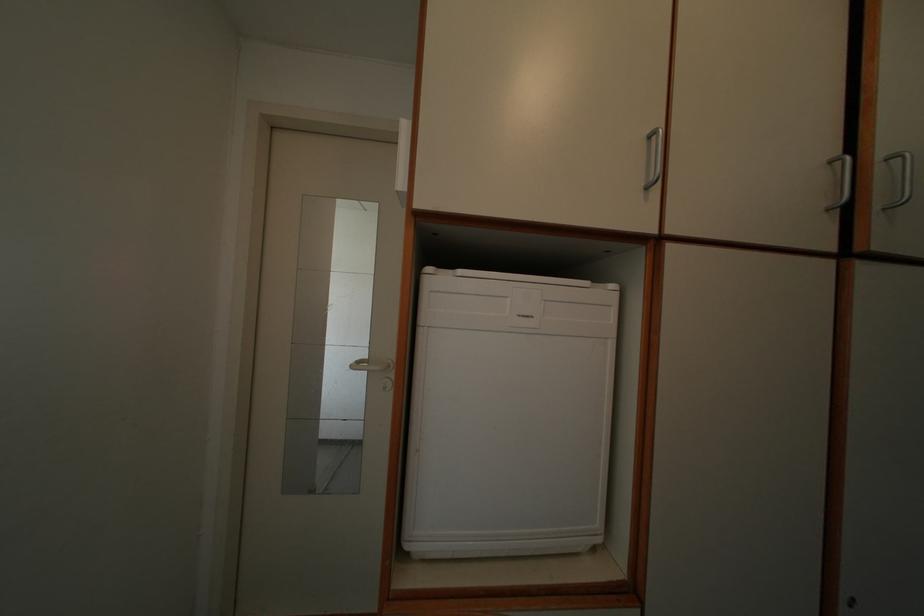
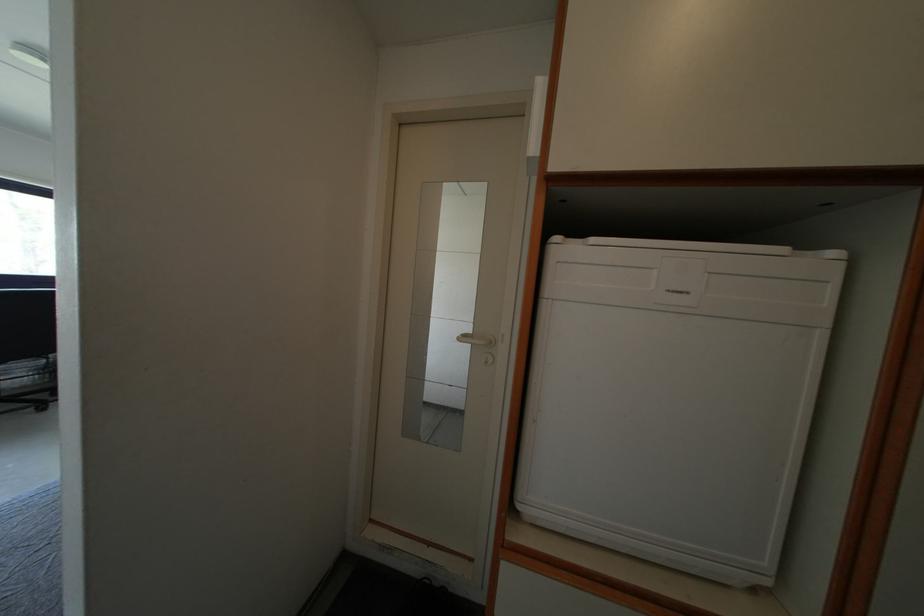
Question: The camera is either moving clockwise (left) or counter-clockwise (right) around the object. The first image is from the beginning of the video and the second image is from the end. Is the camera moving left or right when shooting the video?

Choices:
 (A) Left
 (B) Right

Answer: (B)